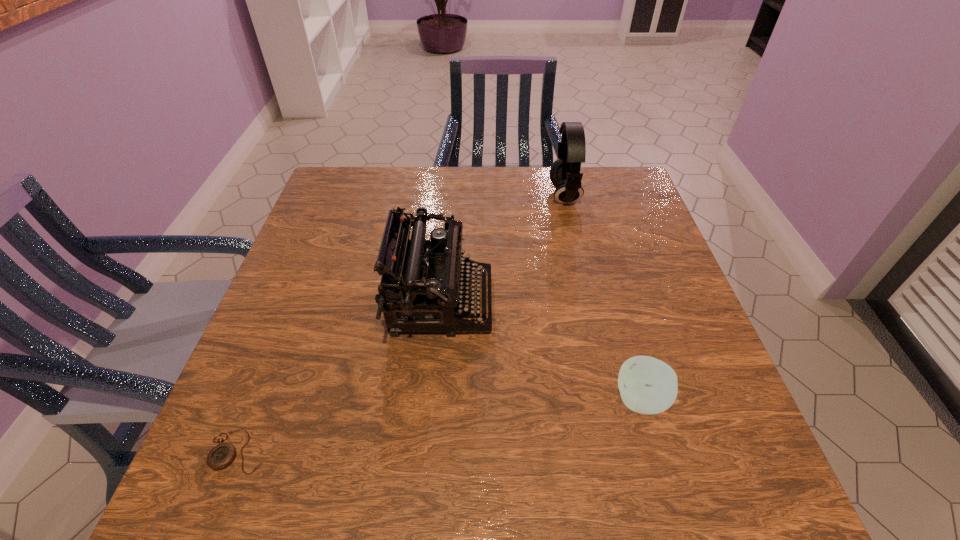
What are the coordinates of `empty location between the apple and the earphone` in the screenshot? It's located at (603, 298).

Find the location of a particular element. The width and height of the screenshot is (960, 540). free area in between the second nearest object and the earphone is located at coordinates (603, 298).

The image size is (960, 540). In order to click on vacant region between the farthest object and the apple in this screenshot , I will do `click(603, 298)`.

Identify which object is located as the nearest to the earphone. Please provide its 2D coordinates. Your answer should be formatted as a tuple, i.e. [(x, y)], where the tuple contains the x and y coordinates of a point satisfying the conditions above.

[(436, 284)]

Locate an element on the screen. This screenshot has height=540, width=960. the third closest object to the earphone is located at coordinates (222, 455).

At what (x,y) coordinates should I click in order to perform the action: click on vacant space that satisfies the following two spatial constraints: 1. on the ear cups of the farthest object; 2. on the front side of the nearest object. Please return your answer as a coordinate pair (x, y). The image size is (960, 540). Looking at the image, I should click on (624, 451).

Identify the location of vacant space that satisfies the following two spatial constraints: 1. on the keyboard of the third nearest object; 2. on the right side of the apple. The width and height of the screenshot is (960, 540). (432, 400).

You are a GUI agent. You are given a task and a screenshot of the screen. Output one action in this format:
    pyautogui.click(x=<x>, y=<y>)
    Task: Click on the free space that satisfies the following two spatial constraints: 1. on the back side of the apple; 2. on the right side of the leftmost object
    
    Given the screenshot: What is the action you would take?
    pyautogui.click(x=259, y=400)

Image resolution: width=960 pixels, height=540 pixels. I want to click on free location that satisfies the following two spatial constraints: 1. on the ear cups of the earphone; 2. on the right side of the third tallest object, so click(x=612, y=400).

At what (x,y) coordinates should I click in order to perform the action: click on vacant space that satisfies the following two spatial constraints: 1. on the ear cups of the third farthest object; 2. on the right side of the farthest object. Please return your answer as a coordinate pair (x, y). This screenshot has height=540, width=960. Looking at the image, I should click on (612, 400).